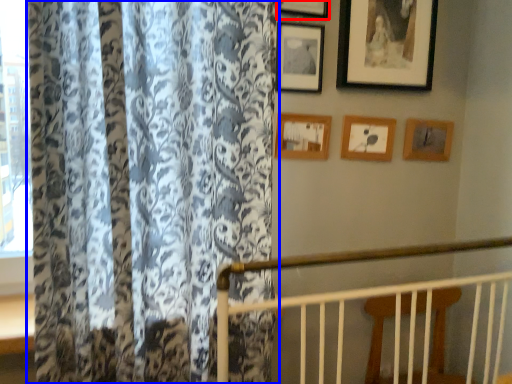
Question: Which object appears farthest to the camera in this image, picture frame (highlighted by a red box) or curtain (highlighted by a blue box)?

Choices:
 (A) picture frame
 (B) curtain

Answer: (A)